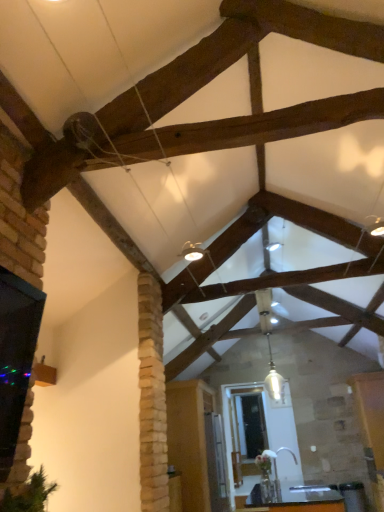
Question: Is black glass window at left bigger than white glass pendant light at center?

Choices:
 (A) yes
 (B) no

Answer: (A)

Question: Would you say black glass window at left contains white glass pendant light at center?

Choices:
 (A) yes
 (B) no

Answer: (B)

Question: Is black glass window at left positioned beyond the bounds of white glass pendant light at center?

Choices:
 (A) yes
 (B) no

Answer: (A)

Question: Is black glass window at left smaller than white glass pendant light at center?

Choices:
 (A) yes
 (B) no

Answer: (B)

Question: Considering the relative sizes of black glass window at left and white glass pendant light at center in the image provided, is black glass window at left wider than white glass pendant light at center?

Choices:
 (A) no
 (B) yes

Answer: (B)

Question: From a real-world perspective, is black glass window at left on top of white glass pendant light at center?

Choices:
 (A) no
 (B) yes

Answer: (A)

Question: Can you confirm if wooden table at lower center is thinner than black glass window at left?

Choices:
 (A) yes
 (B) no

Answer: (B)

Question: Could black glass window at left be considered to be inside wooden table at lower center?

Choices:
 (A) yes
 (B) no

Answer: (B)

Question: Does wooden table at lower center appear on the right side of black glass window at left?

Choices:
 (A) no
 (B) yes

Answer: (B)

Question: Does wooden table at lower center have a larger size compared to black glass window at left?

Choices:
 (A) no
 (B) yes

Answer: (B)

Question: Does wooden table at lower center have a greater width compared to black glass window at left?

Choices:
 (A) no
 (B) yes

Answer: (B)

Question: From a real-world perspective, is wooden table at lower center positioned under black glass window at left based on gravity?

Choices:
 (A) yes
 (B) no

Answer: (A)

Question: From the image's perspective, is white glass pendant light at center under black glass window at left?

Choices:
 (A) no
 (B) yes

Answer: (B)